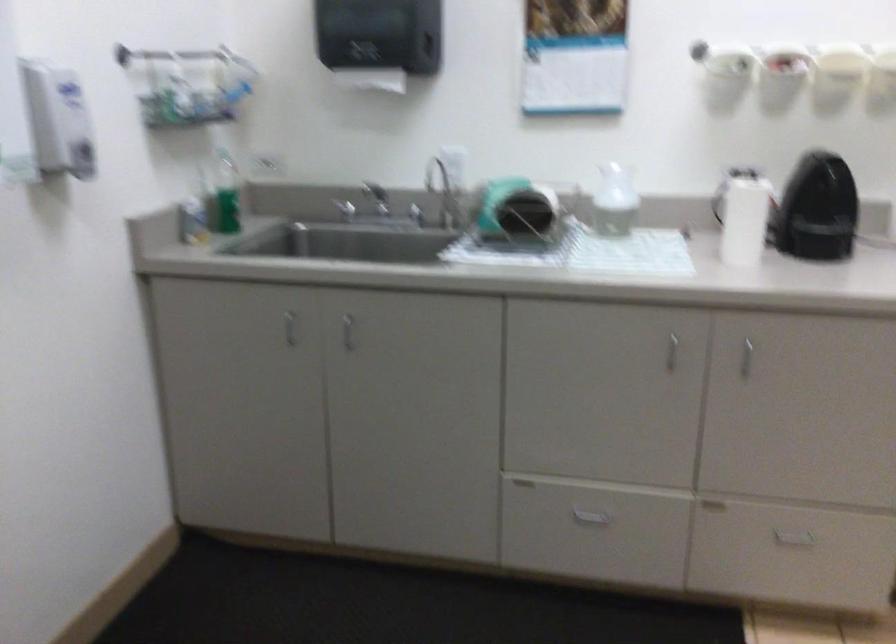
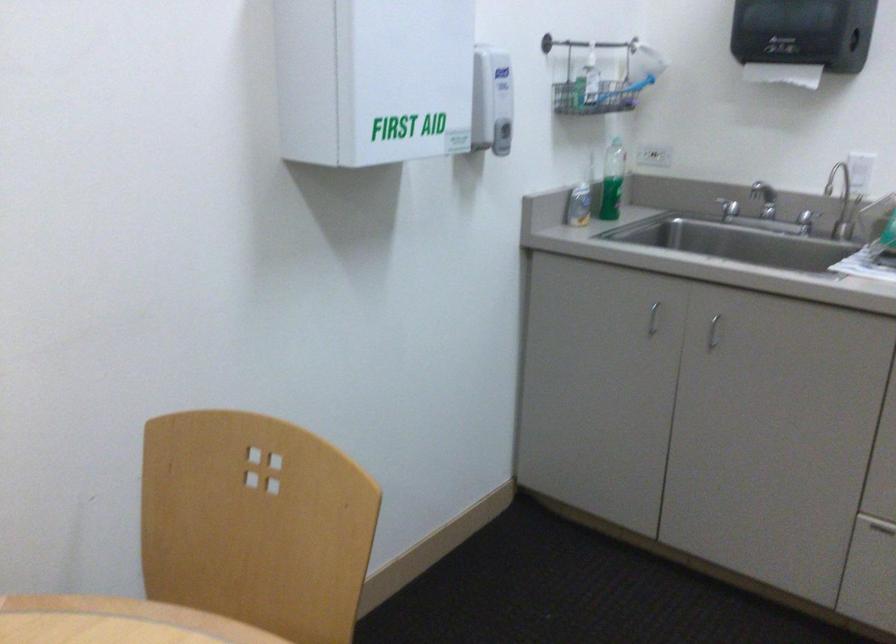
In the second image, find the point that corresponds to (339,214) in the first image.

(728, 207)